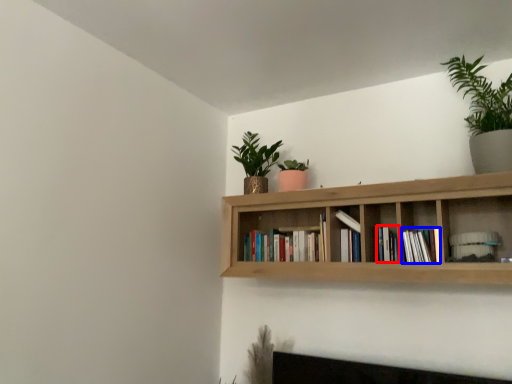
Question: Among these objects, which one is farthest to the camera, book (highlighted by a red box) or book (highlighted by a blue box)?

Choices:
 (A) book
 (B) book

Answer: (A)